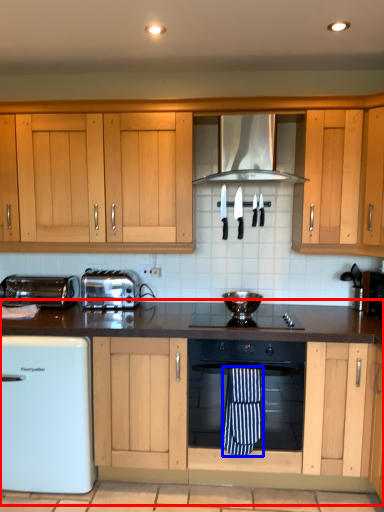
Question: Among these objects, which one is nearest to the camera, countertop (highlighted by a red box) or beach towel (highlighted by a blue box)?

Choices:
 (A) countertop
 (B) beach towel

Answer: (A)